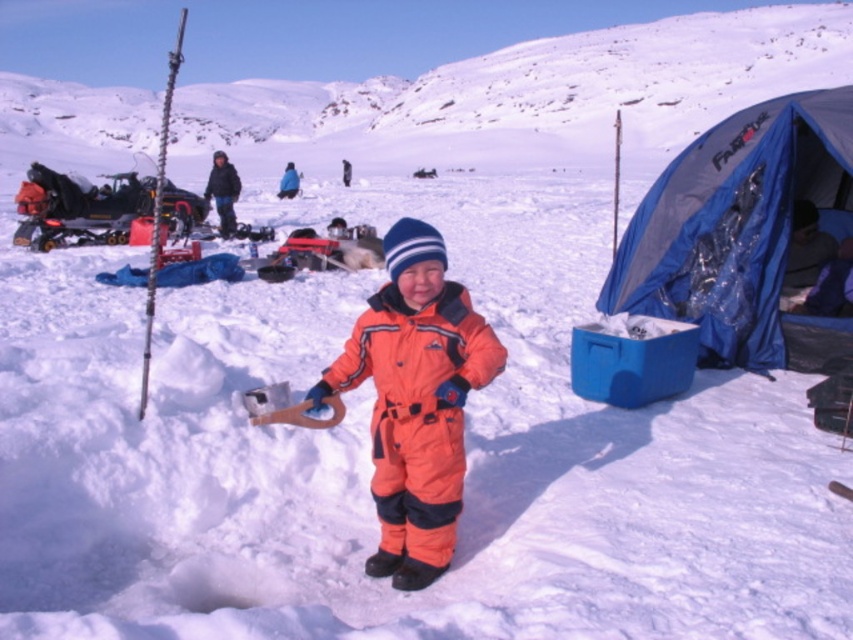
You are a photographer trying to capture a clear shot of the orange snowsuit at center and the blue woolen hat at upper center. Since you want both subjects to be visible in the frame, which object should you focus on first to ensure depth of field?

The blue woolen hat at upper center is taller than the orange snowsuit at center, so focusing on the blue woolen hat at upper center first will help ensure both are in focus due to its greater height.

You are a photographer trying to capture the orange softshell snowsuit at center and the dark blue fabric sleeping bag at right in a single shot. Based on their sizes, which object should you focus on first to ensure both are in frame?

The orange softshell snowsuit at center is bigger than the dark blue fabric sleeping bag at right, so you should focus on the orange softshell snowsuit at center first to ensure both are in frame.

You are a photographer trying to capture the orange snowsuit at center and the blue woolen hat at upper center in the same frame. Which object should you adjust your camera to focus on first if you want to include both in your shot?

You should focus on the orange snowsuit at center first because the blue woolen hat at upper center is to the left of it, so adjusting the camera to include the left side first would help capture both.